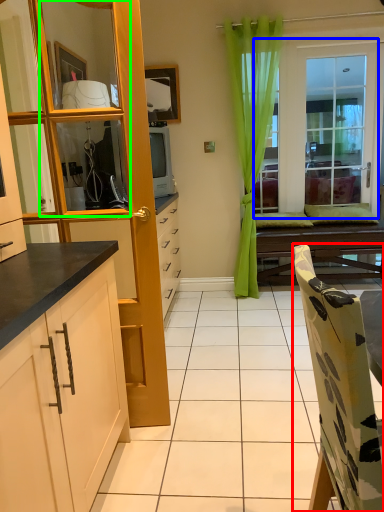
Question: Which object is the closest to the chair (highlighted by a red box)? Choose among these: window (highlighted by a blue box) or mirror (highlighted by a green box).

Choices:
 (A) window
 (B) mirror

Answer: (B)